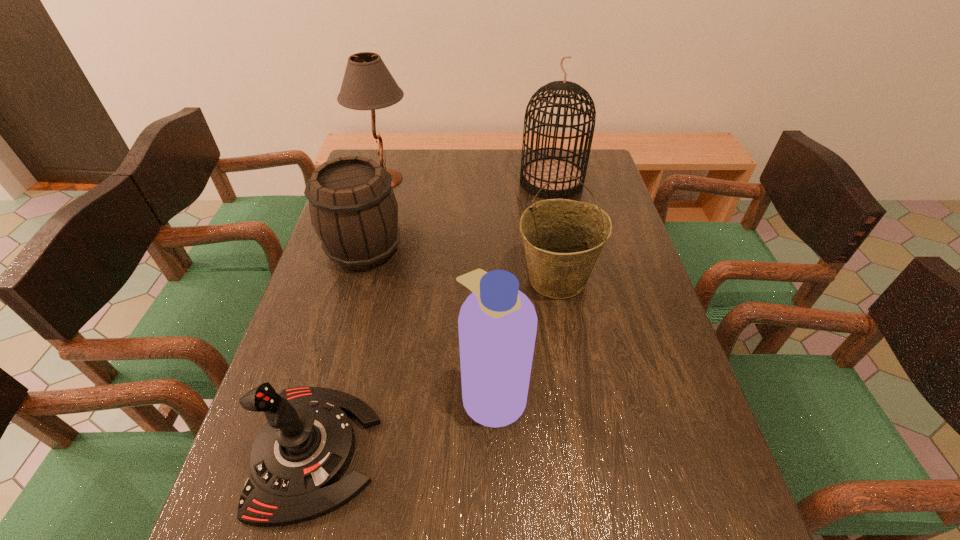
Locate an element on the screen. This screenshot has height=540, width=960. birdcage is located at coordinates (536, 173).

You are a GUI agent. You are given a task and a screenshot of the screen. Output one action in this format:
    pyautogui.click(x=<x>, y=<y>)
    Task: Click on the table lamp
    
    Given the screenshot: What is the action you would take?
    pyautogui.click(x=367, y=84)

Identify the location of shampoo. The height and width of the screenshot is (540, 960). click(x=497, y=323).

Where is `the taller wine bucket`? the taller wine bucket is located at coordinates (562, 238).

Where is `the shorter wine bucket`? the shorter wine bucket is located at coordinates (353, 209).

I want to click on the shortest object, so click(298, 456).

I want to click on vacant region located on the left of the birdcage, so click(488, 181).

I want to click on free space located 0.300m on the front-facing side of the table lamp, so click(x=500, y=179).

I want to click on vacant space located 0.300m on the left of the shampoo, so click(320, 393).

Identify the location of vacant space situated 0.250m on the back of the taller wine bucket. The height and width of the screenshot is (540, 960). (543, 201).